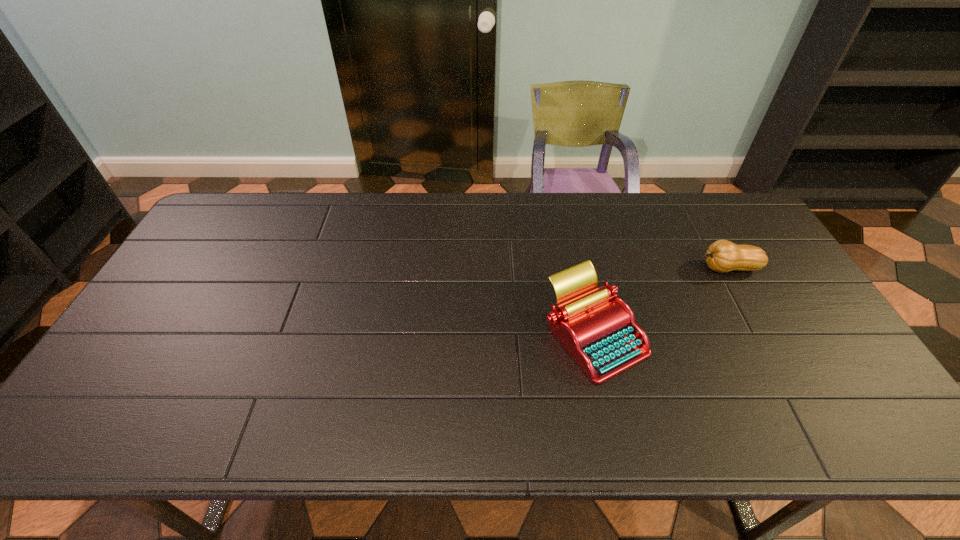
Locate an element on the screen. This screenshot has height=540, width=960. the left object is located at coordinates (601, 335).

Locate an element on the screen. typewriter is located at coordinates click(x=601, y=335).

Where is `the farther object`? the farther object is located at coordinates (722, 256).

Identify the location of the right object. The width and height of the screenshot is (960, 540). (722, 256).

Identify the location of vacant area located on the typing side of the left object. (612, 416).

I want to click on free space located on the stem side of the shorter object, so coord(650,268).

At what (x,y) coordinates should I click in order to perform the action: click on vacant area situated 0.370m on the stem side of the shorter object. Please return your answer as a coordinate pair (x, y). Looking at the image, I should click on (574, 268).

At what (x,y) coordinates should I click in order to perform the action: click on free space located 0.390m on the stem side of the shorter object. Please return your answer as a coordinate pair (x, y). The height and width of the screenshot is (540, 960). Looking at the image, I should click on (567, 268).

The image size is (960, 540). In order to click on object that is at the right edge in this screenshot , I will do `click(722, 256)`.

The width and height of the screenshot is (960, 540). In the image, there is a desktop. Identify the location of free region at the far edge. (665, 208).